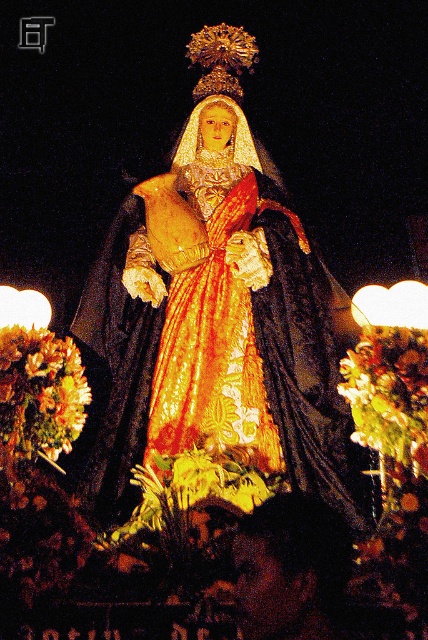
Who is positioned more to the right, shiny dark hair at lower center or golden textured wreath at lower left?

shiny dark hair at lower center is more to the right.

Where is `shiny dark hair at lower center`? shiny dark hair at lower center is located at coordinates (290, 568).

Measure the distance between point (344, 492) and camera.

Point (344, 492) is 333.89 feet from camera.

Between point (154, 192) and point (190, 195), which one is positioned behind?

Point (190, 195)

Is point (282, 346) positioned after point (136, 243)?

No.

In order to click on gold sequined dress at center in this screenshot , I will do pos(214,310).

Between point (225, 228) and point (56, 422), which one is positioned in front?

Point (56, 422) is in front.

In order to click on shiny gold dress at center in this screenshot , I will do `click(213, 333)`.

Is point (146, 442) closer to viewer compared to point (80, 371)?

No.

Locate an element on the screen. This screenshot has height=640, width=428. shiny gold dress at center is located at coordinates (213, 333).